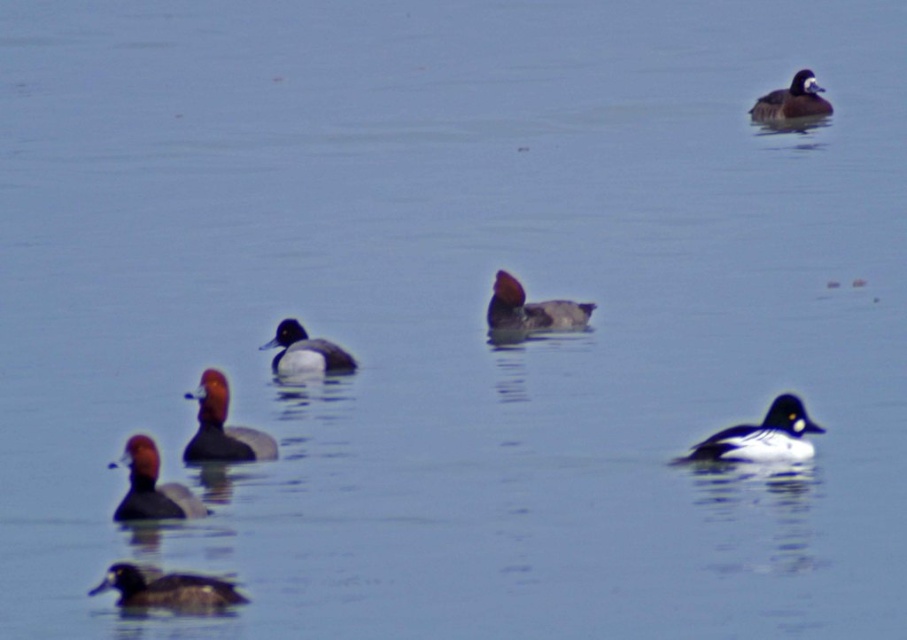
You are a photographer trying to capture a clear shot of the brown matte duck at lower left and the white glossy duck at upper right. Which duck will appear larger in your photo?

The brown matte duck at lower left will appear larger in the photo because it is closer to the viewer than the white glossy duck at upper right.